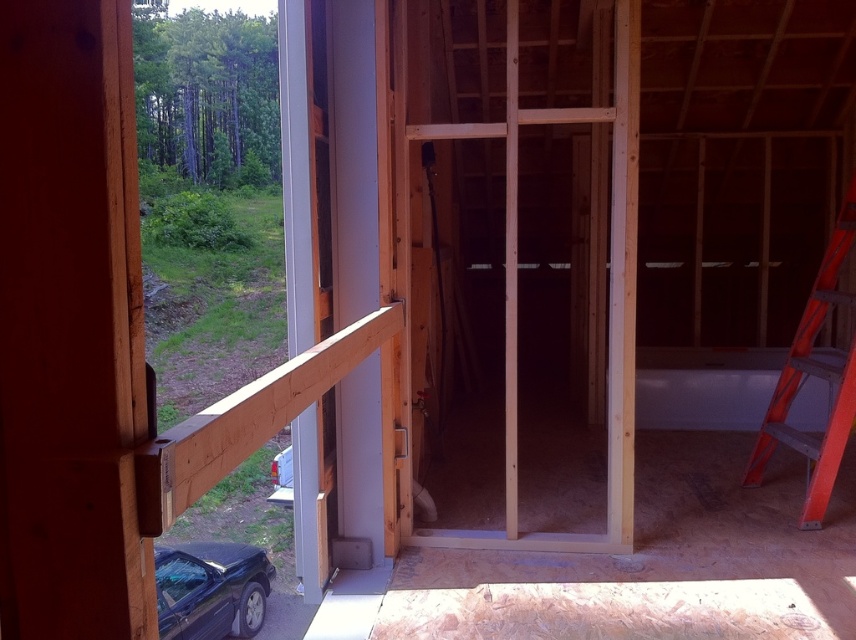
From the picture: Is natural wood beam at left further to camera compared to orange plastic ladder at right?

No.

Based on the photo, between natural wood beam at left and orange plastic ladder at right, which one has more height?

orange plastic ladder at right is taller.

Which is in front, point (333, 346) or point (834, 364)?

Point (333, 346)

This screenshot has width=856, height=640. I want to click on natural wood beam at left, so click(x=245, y=420).